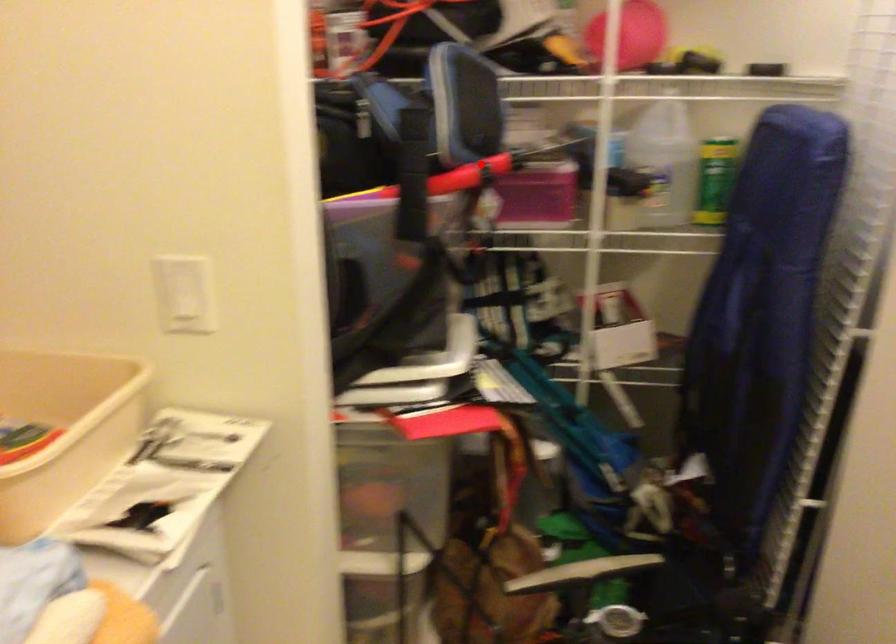
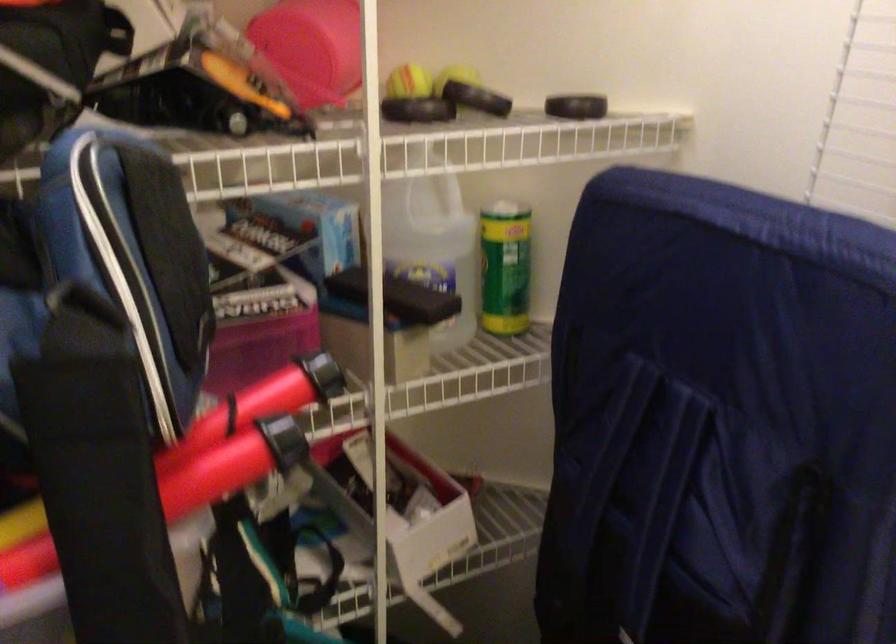
Question: I am providing you with two images of the same scene from different viewpoints. In image1, a red point is highlighted. Considering the same 3D point in image2, which of the following is correct?

Choices:
 (A) It is closer
 (B) It is farther

Answer: (A)